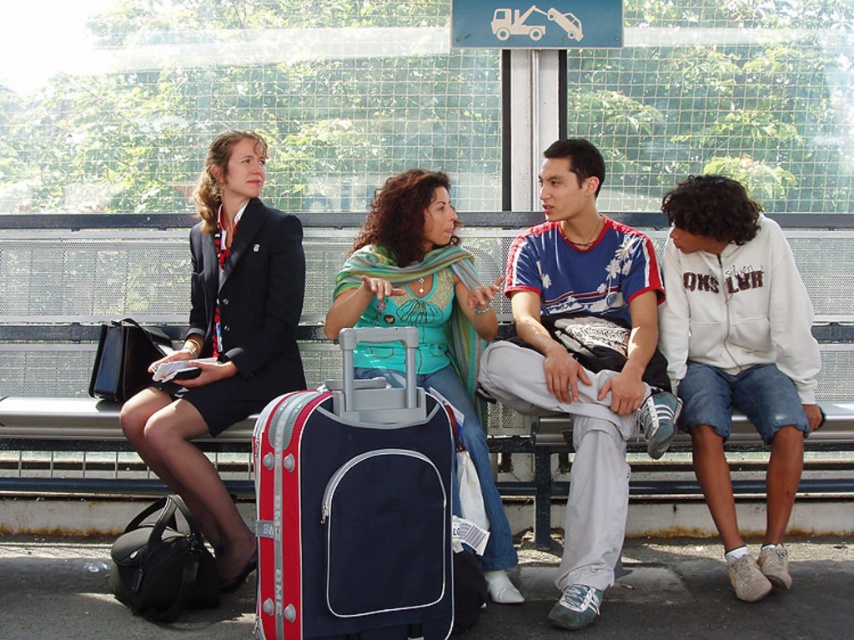
Question: Is metallic silver bench at center bigger than blue fabric suitcase at center?

Choices:
 (A) yes
 (B) no

Answer: (A)

Question: Which object is positioned farthest from the metallic silver bench at center?

Choices:
 (A) white fleece jacket at right
 (B) blue fabric suitcase at center
 (C) green striped scarf at center
 (D) blue printed t-shirt at center

Answer: (A)

Question: Which object is positioned closest to the green striped scarf at center?

Choices:
 (A) blue fabric suitcase at center
 (B) matte black suit at left
 (C) metallic silver bench at center

Answer: (B)

Question: Does blue fabric suitcase at center have a lesser width compared to white fleece jacket at right?

Choices:
 (A) no
 (B) yes

Answer: (A)

Question: Which of the following is the farthest from the observer?

Choices:
 (A) blue fabric suitcase at center
 (B) blue printed t-shirt at center
 (C) metallic silver bench at center

Answer: (C)

Question: Is blue printed t-shirt at center behind green striped scarf at center?

Choices:
 (A) yes
 (B) no

Answer: (B)